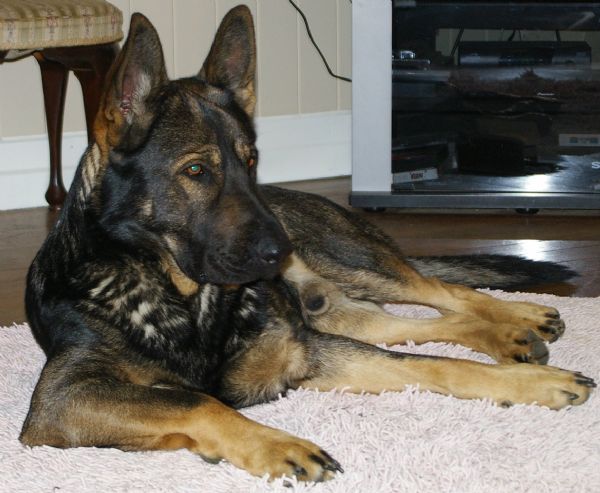
Where is `cord`? The image size is (600, 493). cord is located at coordinates (319, 51).